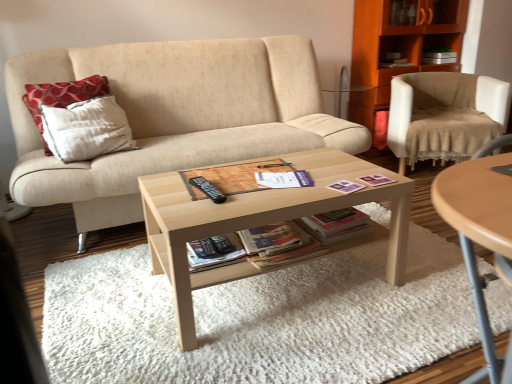
The image size is (512, 384). I want to click on free space to the right of white paper at center, so click(329, 180).